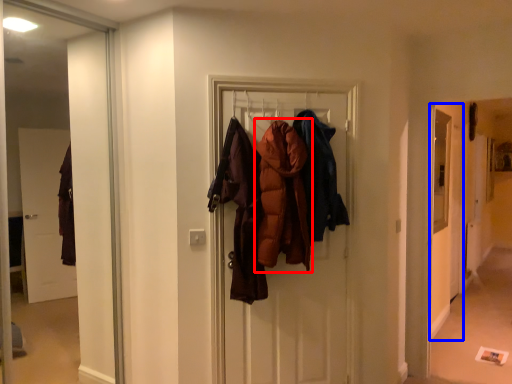
Question: Which point is further to the camera, garment (highlighted by a red box) or screen door (highlighted by a blue box)?

Choices:
 (A) garment
 (B) screen door

Answer: (B)